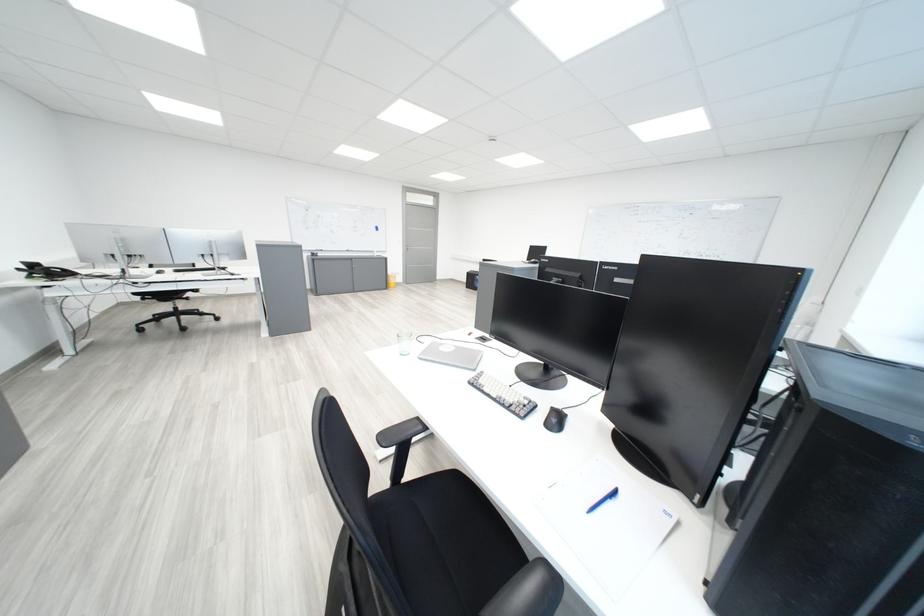
Identify the location of closed silver laptop. (451, 355).